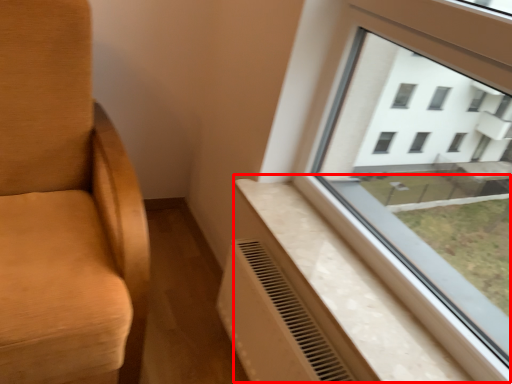
Question: From the image's perspective, where is window sill (annotated by the red box) located relative to air conditioning?

Choices:
 (A) above
 (B) below

Answer: (A)